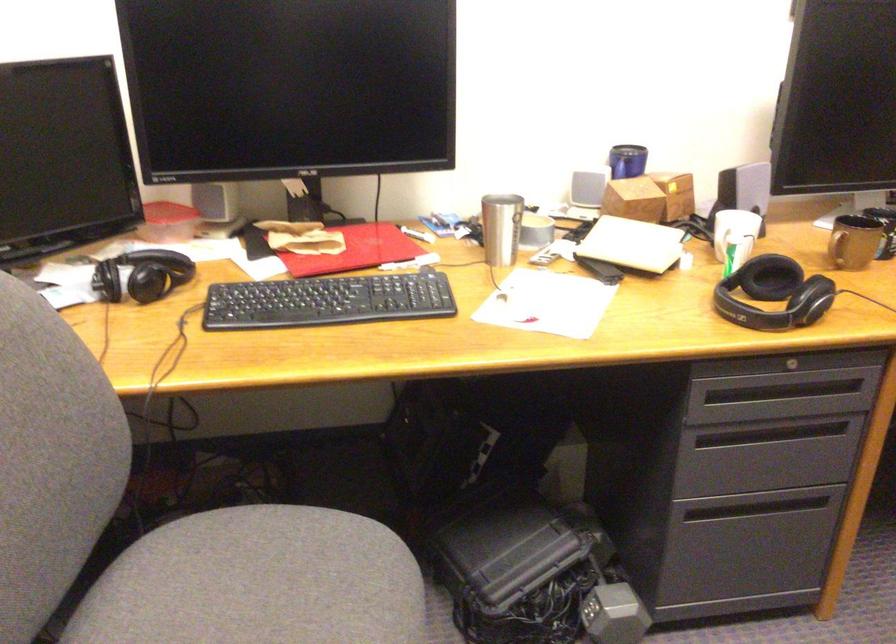
Which object does [501,228] point to?

This point indicates the metal tumbler.